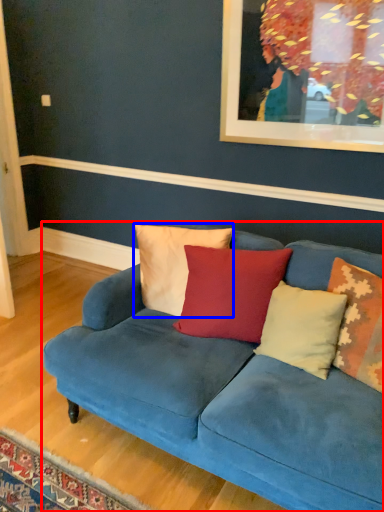
Question: Which object is further to the camera taking this photo, studio couch (highlighted by a red box) or pillow (highlighted by a blue box)?

Choices:
 (A) studio couch
 (B) pillow

Answer: (B)